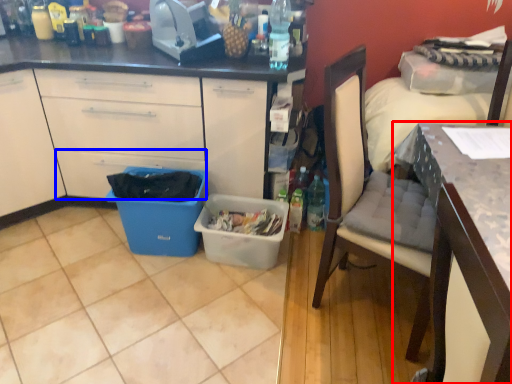
Question: Which point is closer to the camera, desk (highlighted by a red box) or drawer (highlighted by a blue box)?

Choices:
 (A) desk
 (B) drawer

Answer: (A)